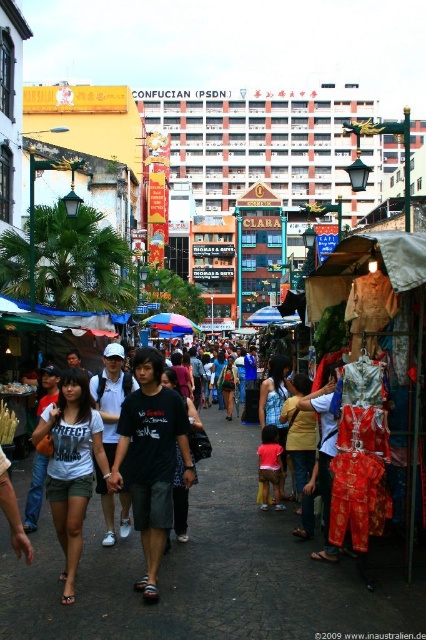
You are a street vendor trying to attract customers to the black cotton shirt at center. Since the dark clothing crowd at center is blocking the view, where should you position yourself to ensure the shirt is visible to passersby?

The black cotton shirt at center is located below the dark clothing crowd at center, so positioning yourself behind the dark clothing crowd at center would allow the shirt to be seen above the crowd.

You are a street vendor trying to attract customers to the black cotton shirt at center. Considering the dark clothing crowd at center, how would you describe the shirt to highlight its uniqueness?

The black cotton shirt at center is thinner than the dark clothing crowd at center, making it a lightweight and breathable option compared to the thicker garments in the crowd.